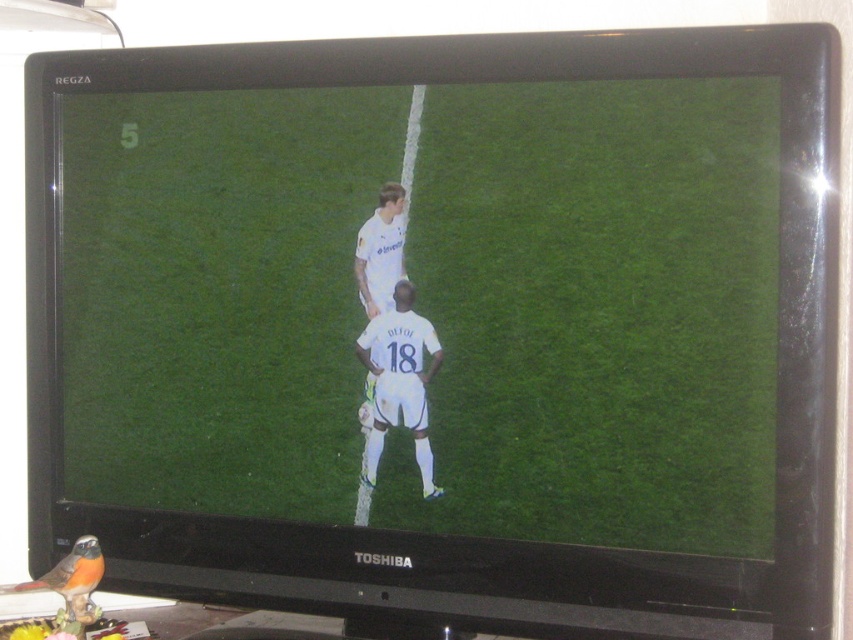
Question: Which of the following is the farthest from the observer?

Choices:
 (A) white matte soccer players at center
 (B) white smooth soccer player at center

Answer: (B)

Question: Does white matte soccer players at center have a lesser width compared to white smooth soccer player at center?

Choices:
 (A) yes
 (B) no

Answer: (B)

Question: Can you confirm if white smooth soccer player at center is positioned to the right of white matte soccer player at center?

Choices:
 (A) yes
 (B) no

Answer: (A)

Question: Which point is closer to the camera?

Choices:
 (A) white smooth soccer player at center
 (B) white matte soccer players at center

Answer: (B)

Question: Can you confirm if white matte soccer players at center is bigger than white smooth soccer player at center?

Choices:
 (A) yes
 (B) no

Answer: (A)

Question: Which point appears closest to the camera in this image?

Choices:
 (A) (384, 362)
 (B) (370, 376)
 (C) (177, 147)

Answer: (A)